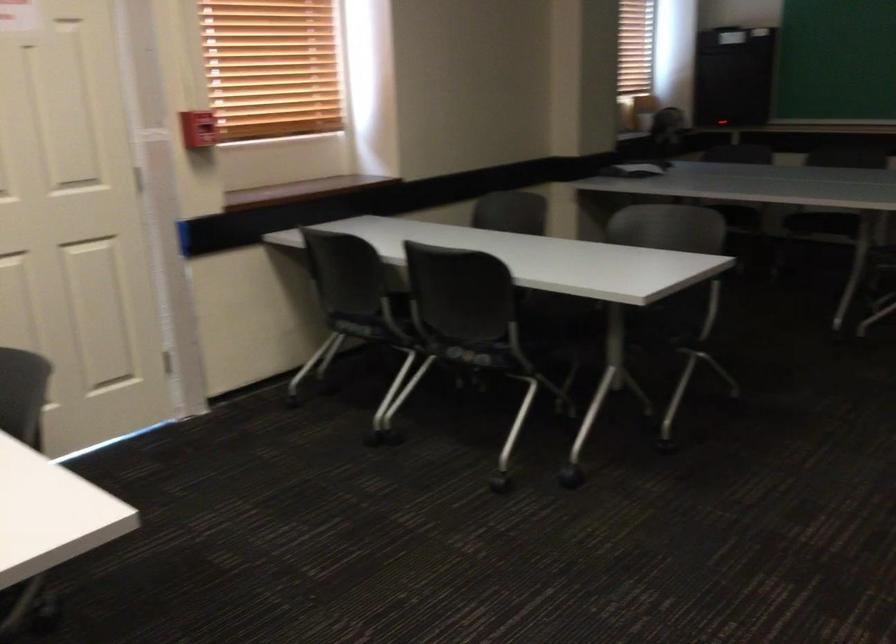
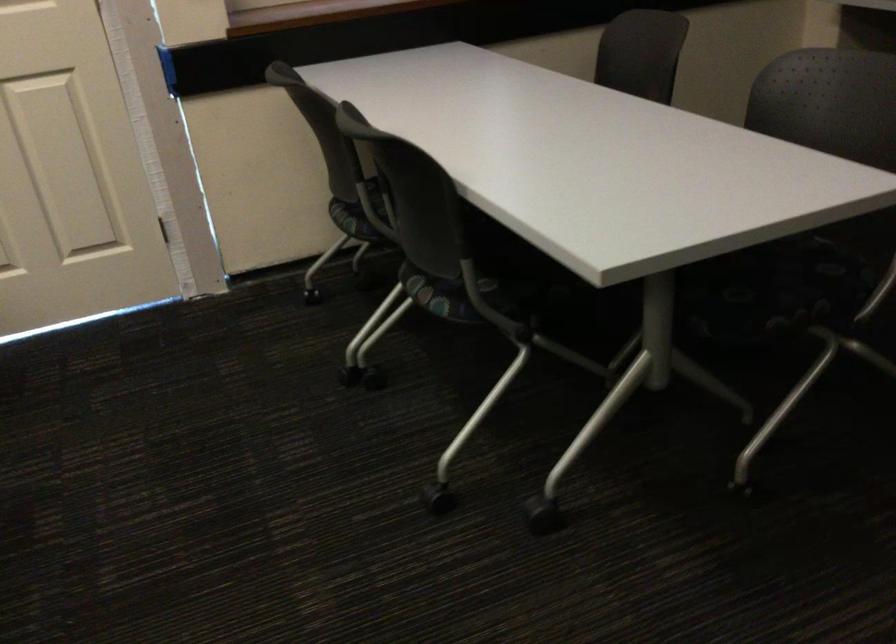
Find the pixel in the second image that matches (357,330) in the first image.

(350, 220)